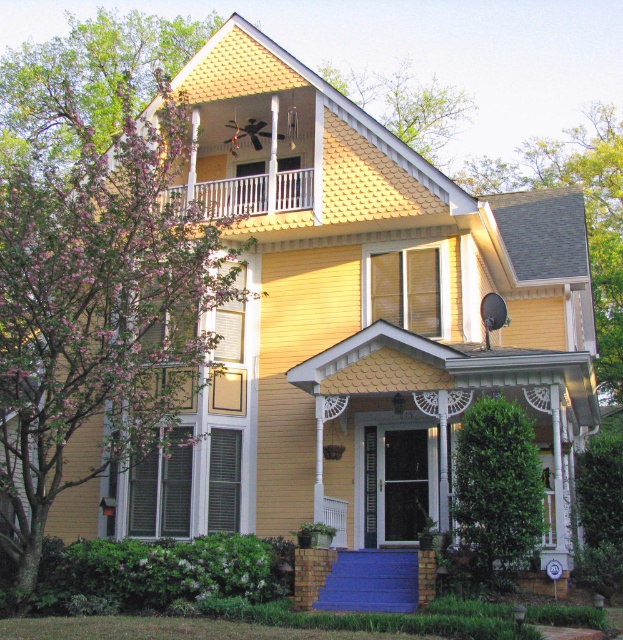
You are a painter standing on the ground in front of the house. You need to paint both the green matte shutter at left and the white metal railing at upper center. Which object should you paint first without moving your ladder?

The green matte shutter at left should be painted first since it is located below the white metal railing at upper center, making it accessible at a lower height without needing to move the ladder to a higher position.

You are a gardener assessing the trees in front of the house. Which tree, the pink blossoming tree at left or the green leafy tree at upper center, requires more space due to its size?

The pink blossoming tree at left requires more space due to its larger size compared to the green leafy tree at upper center.